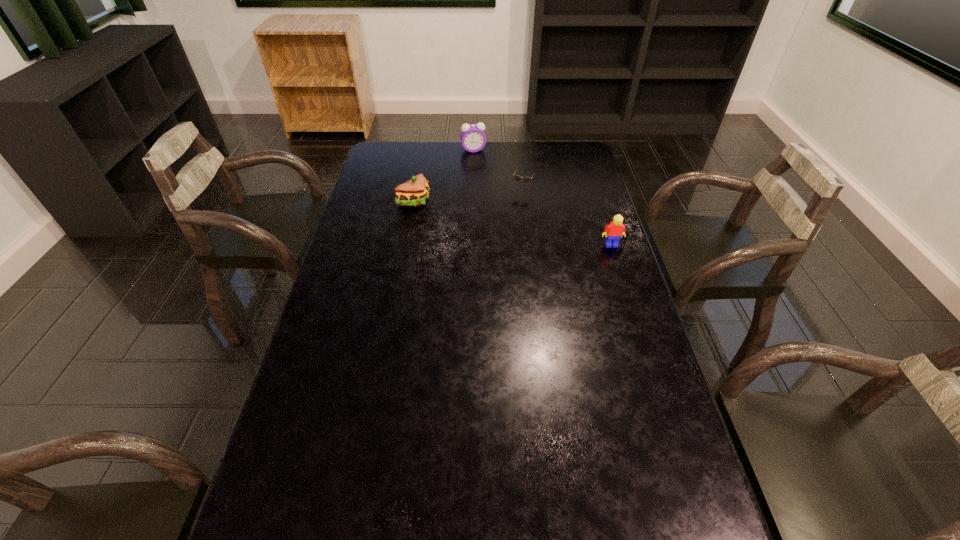
In order to click on vacant area between the alarm clock and the third object from left to right in this screenshot , I will do `click(497, 169)`.

Find the location of `vacant area between the shortest object and the farthest object`. vacant area between the shortest object and the farthest object is located at coordinates (497, 169).

Identify which object is located as the third nearest to the nearest object. Please provide its 2D coordinates. Your answer should be formatted as a tuple, i.e. [(x, y)], where the tuple contains the x and y coordinates of a point satisfying the conditions above.

[(473, 138)]

Where is `the second closest object relative to the farthest object`? the second closest object relative to the farthest object is located at coordinates (414, 192).